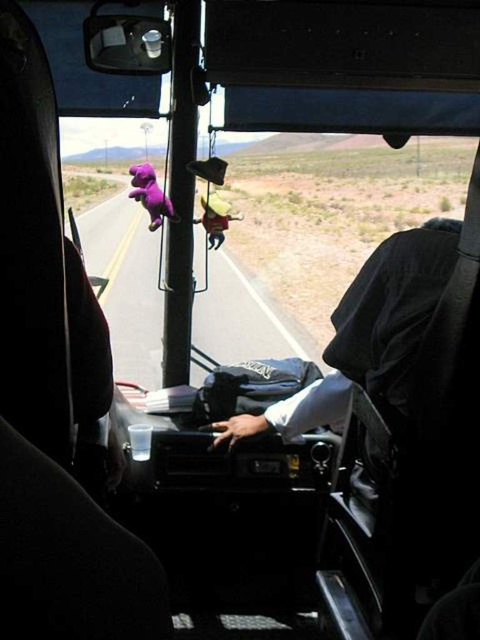
Can you confirm if purple matte dinosaur at center is shorter than yellow fabric stuffed animal at center?

Incorrect, purple matte dinosaur at center's height does not fall short of yellow fabric stuffed animal at center's.

At what (x,y) coordinates should I click in order to perform the action: click on purple matte dinosaur at center. Please return your answer as a coordinate pair (x, y). The width and height of the screenshot is (480, 640). Looking at the image, I should click on (149, 195).